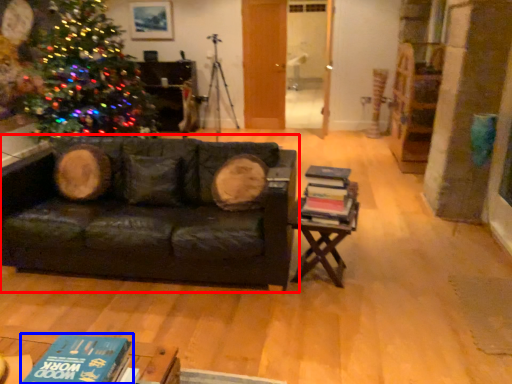
Question: Which object is further to the camera taking this photo, studio couch (highlighted by a red box) or book (highlighted by a blue box)?

Choices:
 (A) studio couch
 (B) book

Answer: (A)